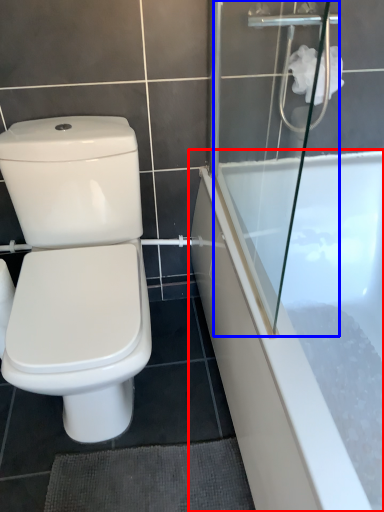
Question: Which of the following is the farthest to the observer, bathtub (highlighted by a red box) or shower door (highlighted by a blue box)?

Choices:
 (A) bathtub
 (B) shower door

Answer: (A)